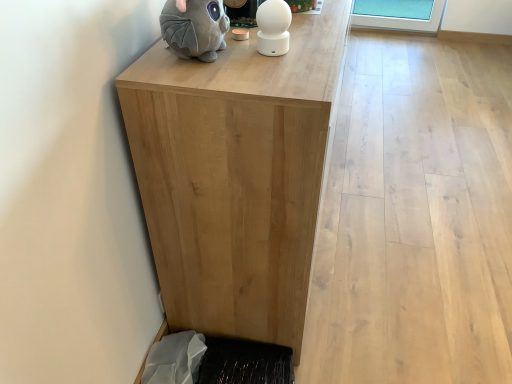
Image resolution: width=512 pixels, height=384 pixels. In order to click on free space to the left of white glossy ball at upper center in this screenshot , I will do `click(212, 58)`.